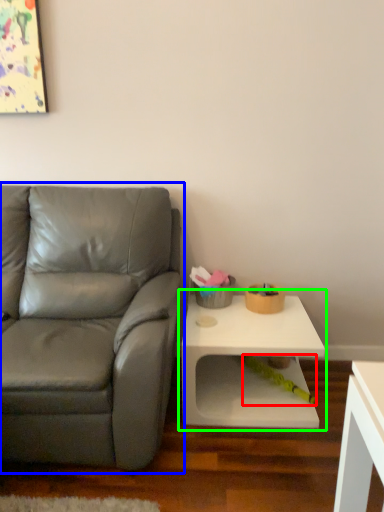
Question: Which is farther away from toy (highlighted by a red box)? studio couch (highlighted by a blue box) or table (highlighted by a green box)?

Choices:
 (A) studio couch
 (B) table

Answer: (A)